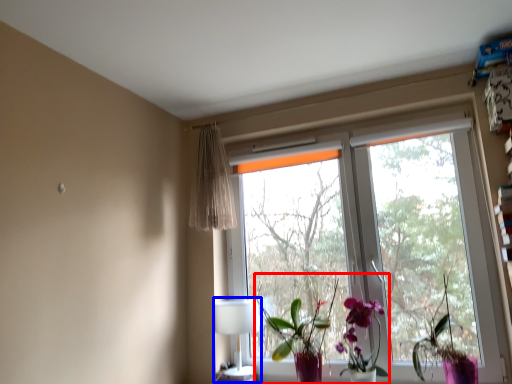
Question: Which point is further to the camera, floral arrangement (highlighted by a red box) or table lamp (highlighted by a blue box)?

Choices:
 (A) floral arrangement
 (B) table lamp

Answer: (B)